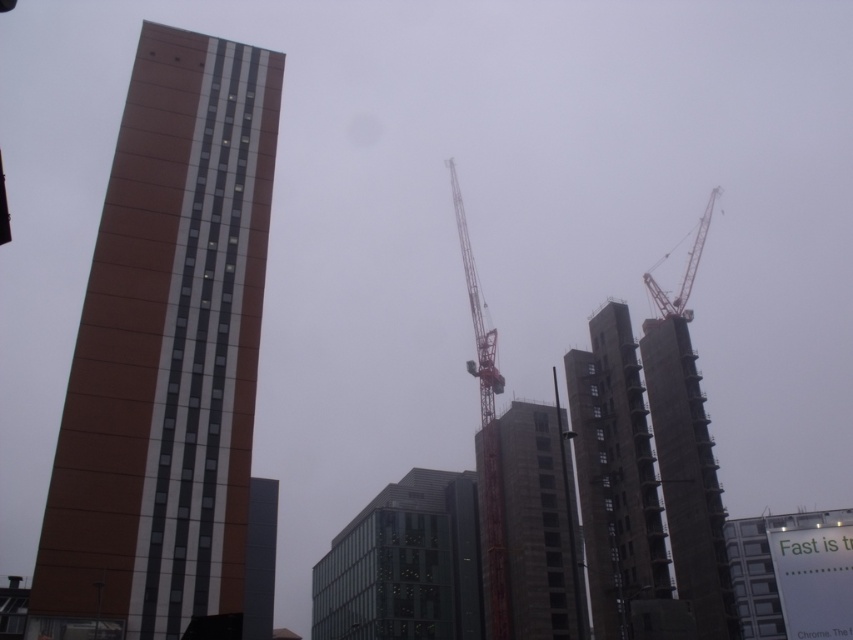
Between dark gray concrete tower at center and orange metallic crane at upper right, which one appears on the right side from the viewer's perspective?

From the viewer's perspective, orange metallic crane at upper right appears more on the right side.

Can you confirm if dark gray concrete tower at center is thinner than orange metallic crane at upper right?

Correct, dark gray concrete tower at center's width is less than orange metallic crane at upper right's.

Identify the location of dark gray concrete tower at center. Image resolution: width=853 pixels, height=640 pixels. (x=260, y=560).

Who is more forward, (256,58) or (262,564)?

Point (256,58)

The width and height of the screenshot is (853, 640). What do you see at coordinates (167, 349) in the screenshot?
I see `brown textured building at left` at bounding box center [167, 349].

Which is in front, point (189, 259) or point (265, 499)?

Point (189, 259)

This screenshot has height=640, width=853. What are the coordinates of `brown textured building at left` in the screenshot? It's located at (167, 349).

Who is taller, dark gray concrete building at center or gray concrete building at center?

Standing taller between the two is dark gray concrete building at center.

Is point (590, 390) positioned after point (514, 600)?

That is False.

This screenshot has height=640, width=853. What do you see at coordinates (614, 474) in the screenshot? I see `dark gray concrete building at center` at bounding box center [614, 474].

At what (x,y) coordinates should I click in order to perform the action: click on dark gray concrete building at center. Please return your answer as a coordinate pair (x, y). The width and height of the screenshot is (853, 640). Looking at the image, I should click on (614, 474).